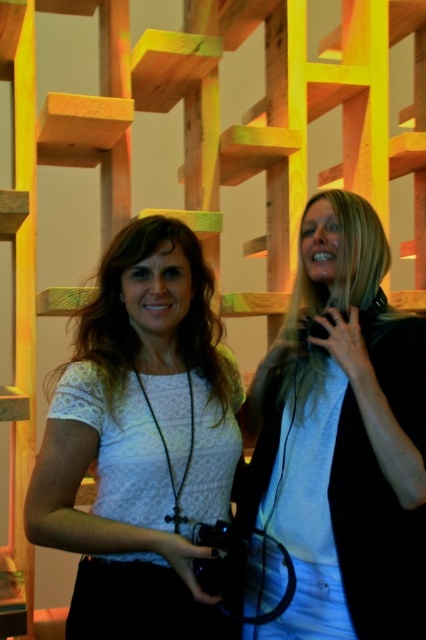
Question: Does light blue denim jeans at center have a lesser width compared to white lace shirt at center?

Choices:
 (A) no
 (B) yes

Answer: (B)

Question: Which point is closer to the camera?

Choices:
 (A) white lace shirt at center
 (B) light blue denim jeans at center

Answer: (A)

Question: Considering the relative positions of light blue denim jeans at center and white lace shirt at center in the image provided, where is light blue denim jeans at center located with respect to white lace shirt at center?

Choices:
 (A) right
 (B) left

Answer: (A)

Question: Among these objects, which one is nearest to the camera?

Choices:
 (A) white lace shirt at center
 (B) light blue denim jeans at center

Answer: (A)

Question: Does light blue denim jeans at center appear over white lace shirt at center?

Choices:
 (A) no
 (B) yes

Answer: (B)